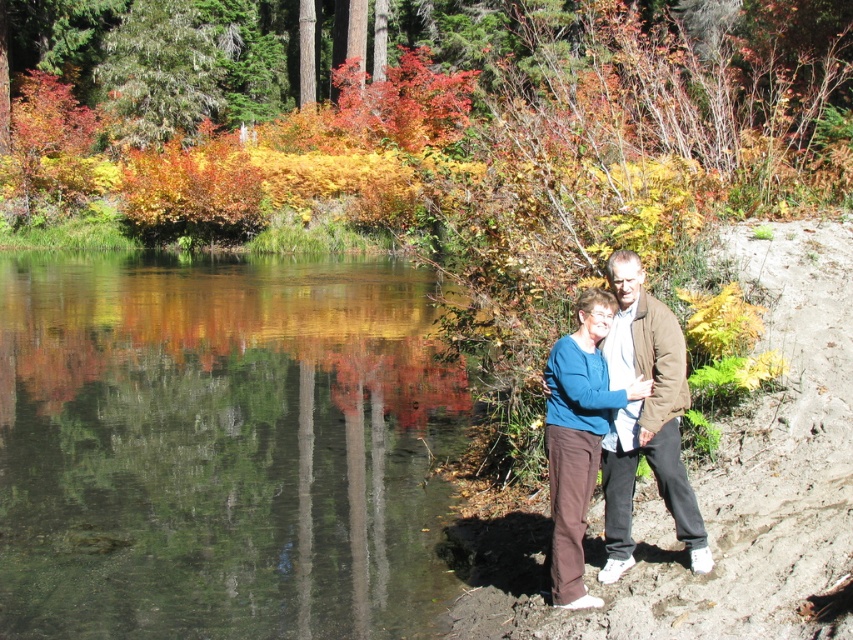
You are standing at the edge of the water in the autumn scene. There is a clear water at center marked by point (222, 445). If you want to walk towards the clear water at center, which direction should you move relative to your current position?

The clear water at center is located at point (222, 445), so you should move towards the center of the water to reach it.

You are an observer standing at the edge of the water. You see the clear water at center and the blue sweater at center. Which object is closer to you?

The clear water at center is positioned over the blue sweater at center, so the clear water at center is closer to you.